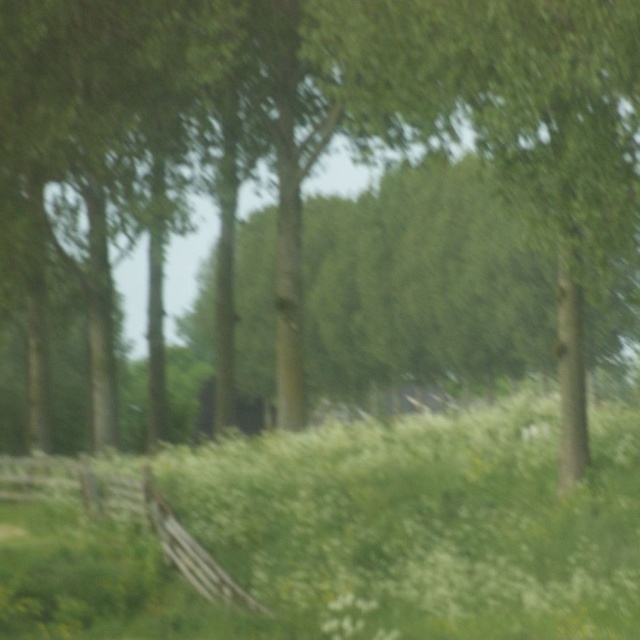
Does point (372, 472) come in front of point (122, 500)?

No, (372, 472) is behind (122, 500).

Does green leafy grass at lower center appear over wooden fence at lower left?

Yes, green leafy grass at lower center is above wooden fence at lower left.

Where is `green leafy grass at lower center`? The height and width of the screenshot is (640, 640). green leafy grass at lower center is located at coordinates (342, 532).

Identify the location of green leafy grass at lower center. [342, 532].